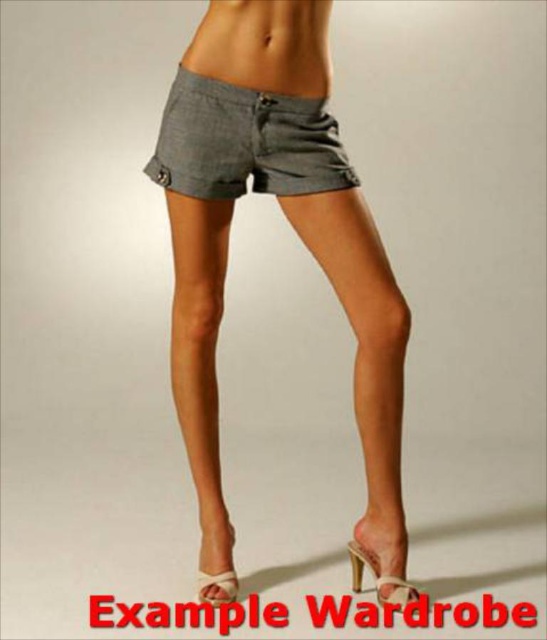
Question: Does matte gray shorts at center appear on the left side of gray cotton shorts at center?

Choices:
 (A) yes
 (B) no

Answer: (B)

Question: Which point is farther from the camera taking this photo?

Choices:
 (A) 218,134
 (B) 189,44

Answer: (B)

Question: Which point is farther to the camera?

Choices:
 (A) (222, 150)
 (B) (182, 136)

Answer: (A)

Question: Does matte gray shorts at center appear under gray cotton shorts at center?

Choices:
 (A) no
 (B) yes

Answer: (B)

Question: Which point is farther from the camera taking this photo?

Choices:
 (A) (240, 134)
 (B) (327, 141)

Answer: (B)

Question: Can you confirm if matte gray shorts at center is smaller than gray cotton shorts at center?

Choices:
 (A) no
 (B) yes

Answer: (A)